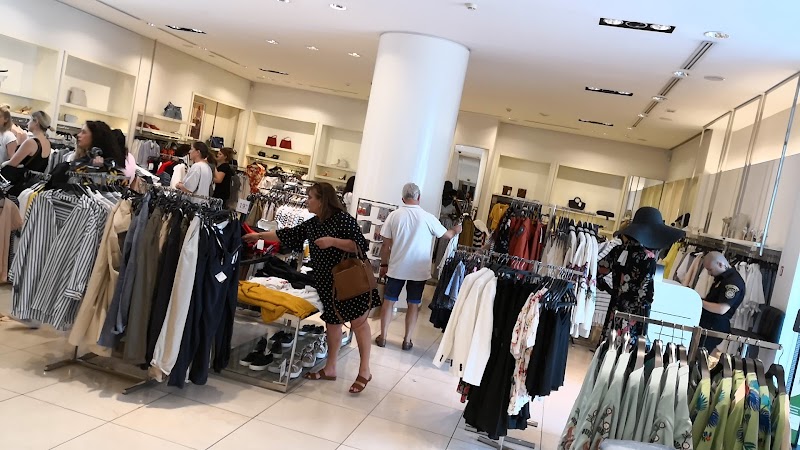
In order to click on tiled floor in this screenshot , I will do `click(302, 422)`.